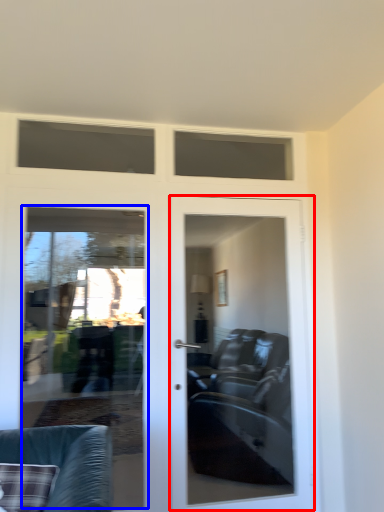
Question: Which point is further to the camera, door (highlighted by a red box) or screen door (highlighted by a blue box)?

Choices:
 (A) door
 (B) screen door

Answer: (A)